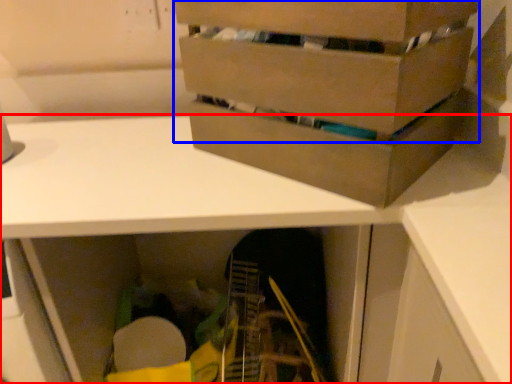
Question: Among these objects, which one is farthest to the camera, desk (highlighted by a red box) or box (highlighted by a blue box)?

Choices:
 (A) desk
 (B) box

Answer: (A)